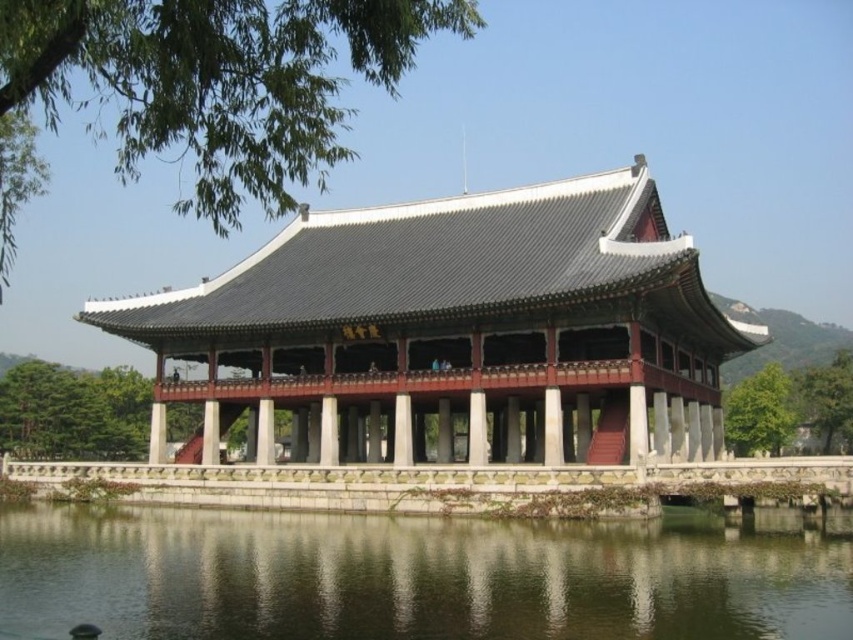
Question: Which object is closer to the camera taking this photo?

Choices:
 (A) matte gray stone palace at center
 (B) transparent water at lower center

Answer: (B)

Question: Which point is closer to the camera?

Choices:
 (A) transparent water at lower center
 (B) matte gray stone palace at center

Answer: (A)

Question: Among these objects, which one is nearest to the camera?

Choices:
 (A) transparent water at lower center
 (B) matte gray stone palace at center

Answer: (A)

Question: Is matte gray stone palace at center bigger than transparent water at lower center?

Choices:
 (A) no
 (B) yes

Answer: (B)

Question: Is the position of matte gray stone palace at center less distant than that of transparent water at lower center?

Choices:
 (A) no
 (B) yes

Answer: (A)

Question: Can you confirm if matte gray stone palace at center is smaller than transparent water at lower center?

Choices:
 (A) no
 (B) yes

Answer: (A)